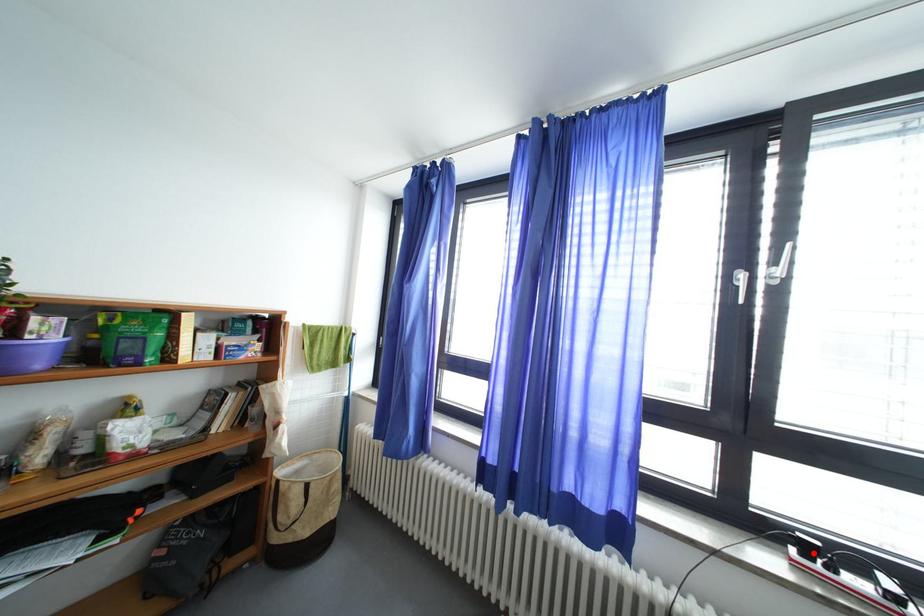
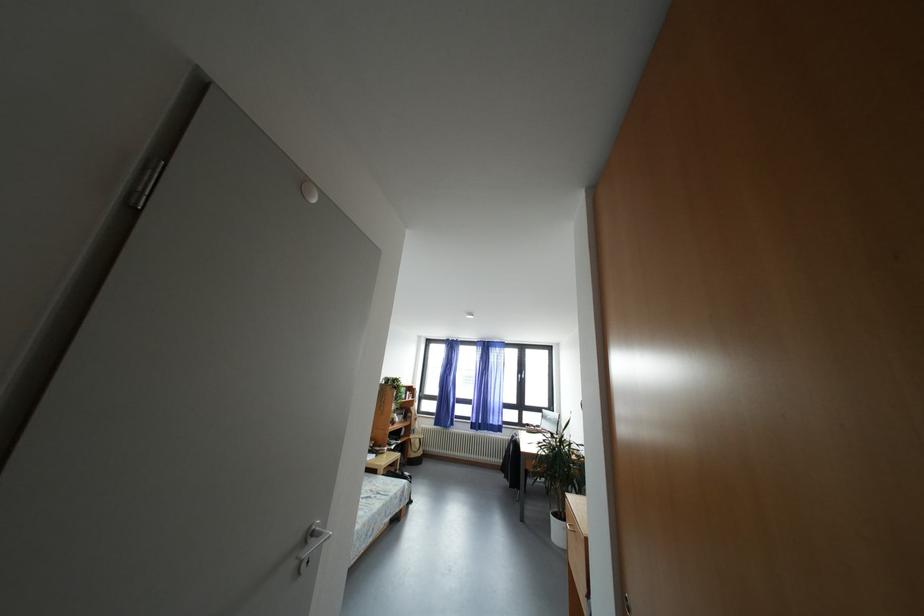
Find the pixel in the second image that matches the highlighted location in the first image.

(533, 430)